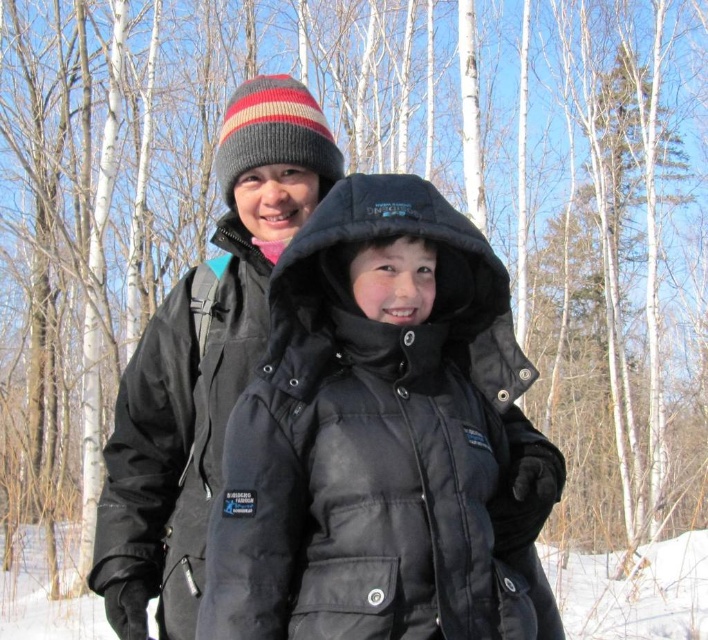
Is matte black jacket at center in front of white fluffy snow at lower center?

Yes.

What do you see at coordinates (202, 362) in the screenshot? I see `matte black jacket at center` at bounding box center [202, 362].

Between point (287, 108) and point (566, 556), which one is positioned behind?

The point (566, 556) is behind.

Where is `matte black jacket at center`? Image resolution: width=708 pixels, height=640 pixels. matte black jacket at center is located at coordinates (202, 362).

Between black softshell jacket at upper center and white fluffy snow at lower center, which one appears on the right side from the viewer's perspective?

black softshell jacket at upper center is more to the right.

Which is in front, point (171, 356) or point (40, 618)?

Positioned in front is point (171, 356).

You are a GUI agent. You are given a task and a screenshot of the screen. Output one action in this format:
    pyautogui.click(x=<x>, y=<y>)
    Task: Click on the black softshell jacket at upper center
    The image size is (708, 640).
    Given the screenshot: What is the action you would take?
    pyautogui.click(x=177, y=436)

Based on the photo, which is more to the left, matte black jacket at center or black softshell jacket at upper center?

black softshell jacket at upper center is more to the left.

I want to click on matte black jacket at center, so click(x=202, y=362).

Is point (118, 580) in front of point (215, 483)?

No.

Locate an element on the screen. This screenshot has height=640, width=708. matte black jacket at center is located at coordinates (202, 362).